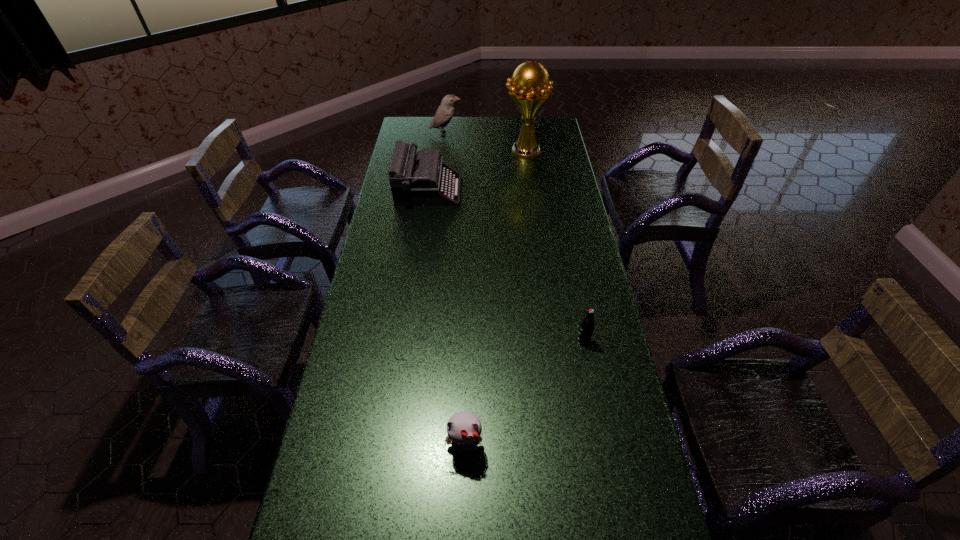
Locate an element on the screen. free space located at the front of the tallest object where the globe is prominent is located at coordinates (448, 151).

This screenshot has width=960, height=540. I want to click on vacant space located at the face of the bird, so click(507, 133).

Locate an element on the screen. The image size is (960, 540). blank space located 0.160m on the typing side of the typewriter is located at coordinates (498, 190).

At what (x,y) coordinates should I click in order to perform the action: click on vacant space located on the front label of the pop. Please return your answer as a coordinate pair (x, y). The height and width of the screenshot is (540, 960). Looking at the image, I should click on (606, 456).

Locate an element on the screen. The width and height of the screenshot is (960, 540). vacant region located 0.170m on the front-facing side of the taller kitten is located at coordinates click(x=462, y=539).

Identify the location of object that is positioned at the far edge. Image resolution: width=960 pixels, height=540 pixels. (445, 112).

I want to click on bird that is positioned at the left edge, so click(x=445, y=112).

This screenshot has height=540, width=960. Identify the location of typewriter at the left edge. (424, 180).

Locate an element on the screen. The height and width of the screenshot is (540, 960). trophy_cup that is at the right edge is located at coordinates (530, 90).

Where is `pop present at the right edge`? The image size is (960, 540). pop present at the right edge is located at coordinates (587, 325).